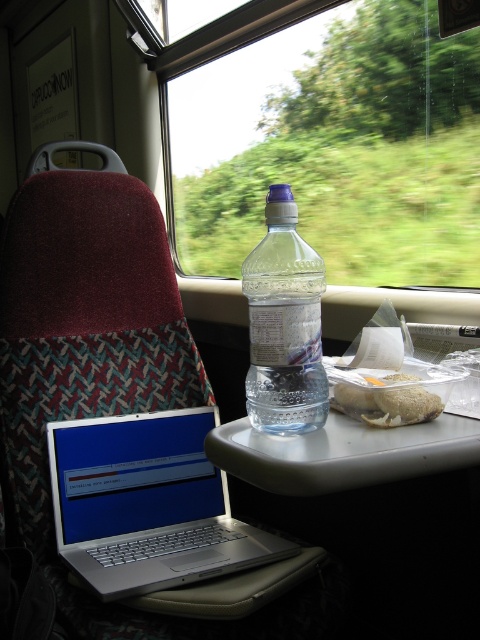
You are a passenger on a train and need to place your phone on the clear plastic tray at center. However, there is a white matte sandwich at center in the way. Can you move the sandwich to make space for your phone?

The clear plastic tray at center is in front of the white matte sandwich at center, so you can move the sandwich to the side or back to create space for your phone on the tray.

What object is located at the coordinates point (336, 147) in the scene?

The transparent plastic bottle at upper center is located at the coordinates point (336, 147).